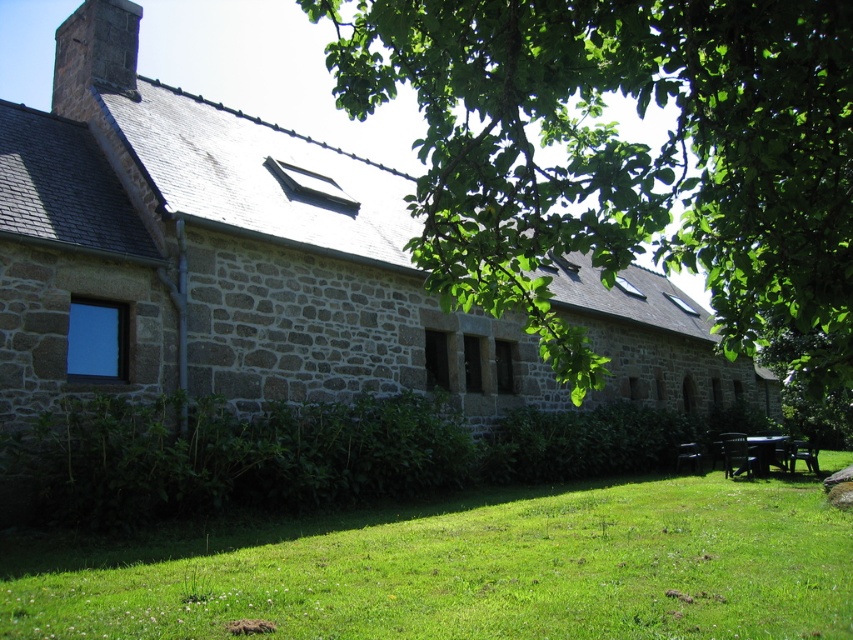
You are planning a picnic and need to set up a blanket. You have a picnic blanket that is 2 meters wide. You see the green grass at lower center and the black plastic picnic table at lower right. Can you place your blanket between them without it overlapping either object?

The distance between the green grass at lower center and the black plastic picnic table at lower right is 10.19 meters. Since your blanket is only 2 meters wide, there is enough space to place it between them without overlapping either object.

You are standing in the courtyard in front of the stone building. You see a green leafy tree at upper center and a black plastic picnic table at lower right. Which object is positioned to the left when viewed from your perspective?

The green leafy tree at upper center is positioned to the left of the black plastic picnic table at lower right.